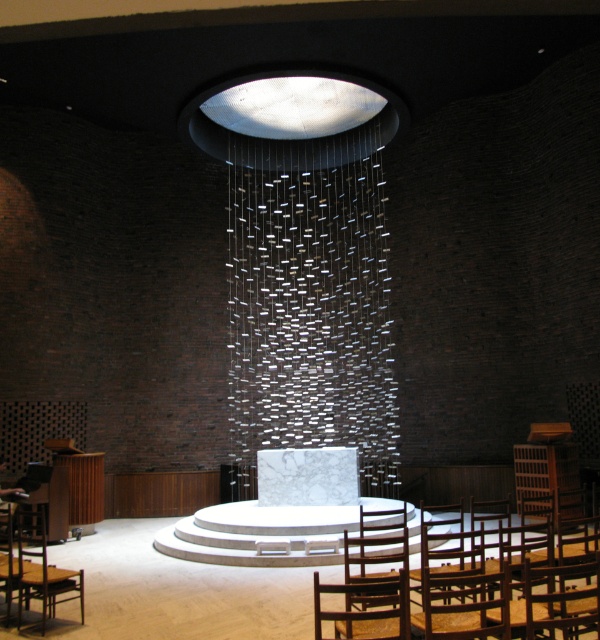
Question: Is wooden chair at lower right to the left of wooden chair at lower left from the viewer's perspective?

Choices:
 (A) yes
 (B) no

Answer: (B)

Question: Which of the following is the closest to the observer?

Choices:
 (A) wooden textured chair at lower right
 (B) wooden chair at lower left
 (C) wooden chair at lower center

Answer: (A)

Question: Is wooden textured chair at lower right to the right of wooden chair at lower center from the viewer's perspective?

Choices:
 (A) no
 (B) yes

Answer: (B)

Question: Estimate the real-world distances between objects in this image. Which object is farther from the wooden chair at lower center?

Choices:
 (A) wooden chair at lower right
 (B) wooden textured chair at lower right

Answer: (A)

Question: Which object is positioned farthest from the wooden chair at lower left?

Choices:
 (A) wooden chair at lower right
 (B) wooden textured chair at lower right

Answer: (B)

Question: Is wooden textured chair at lower right positioned in front of wooden chair at lower center?

Choices:
 (A) no
 (B) yes

Answer: (B)